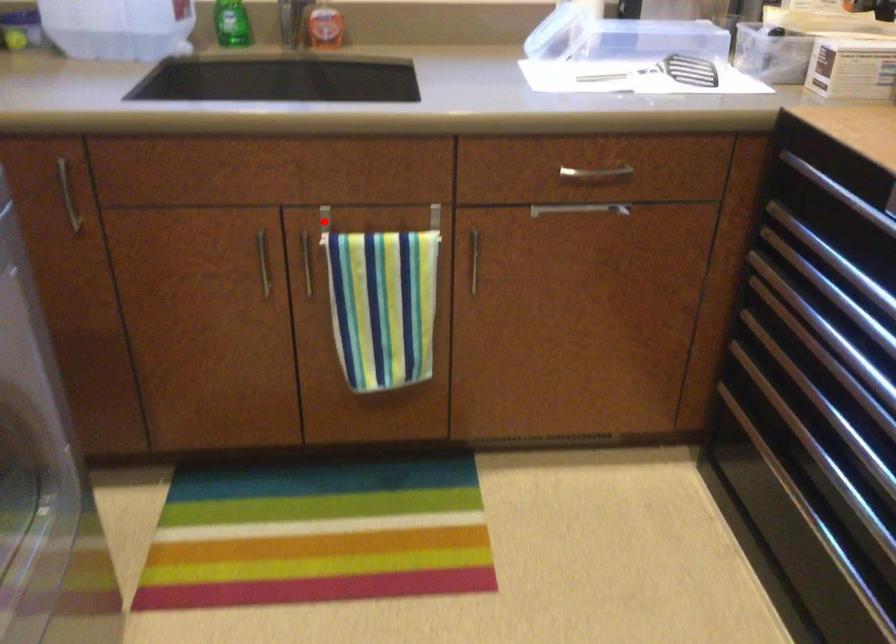
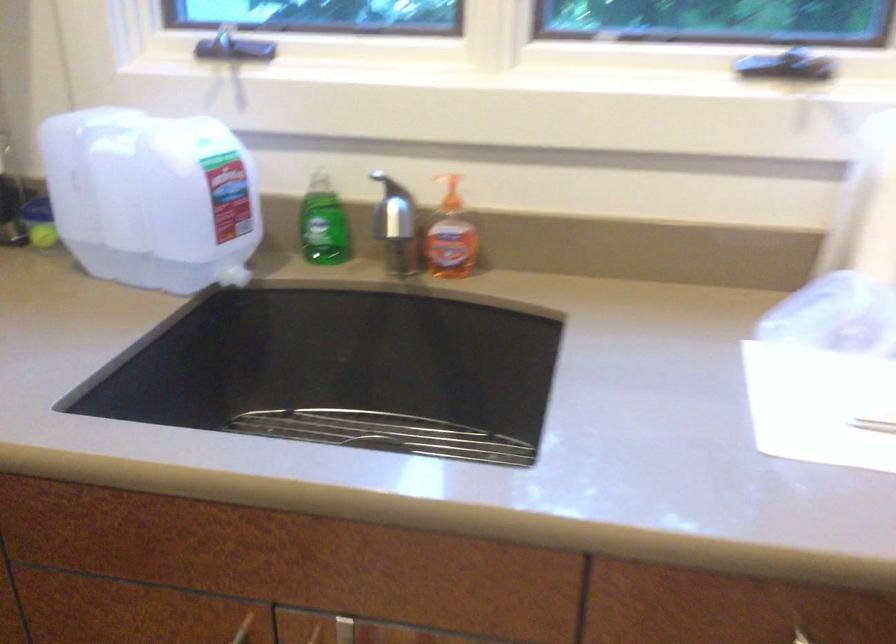
Question: I am providing you with two images of the same scene from different viewpoints. Image1 has a red point marked. In image2, the corresponding 3D location appears at what relative position? Reply with the corresponding letter.

Choices:
 (A) Closer
 (B) Farther

Answer: (A)